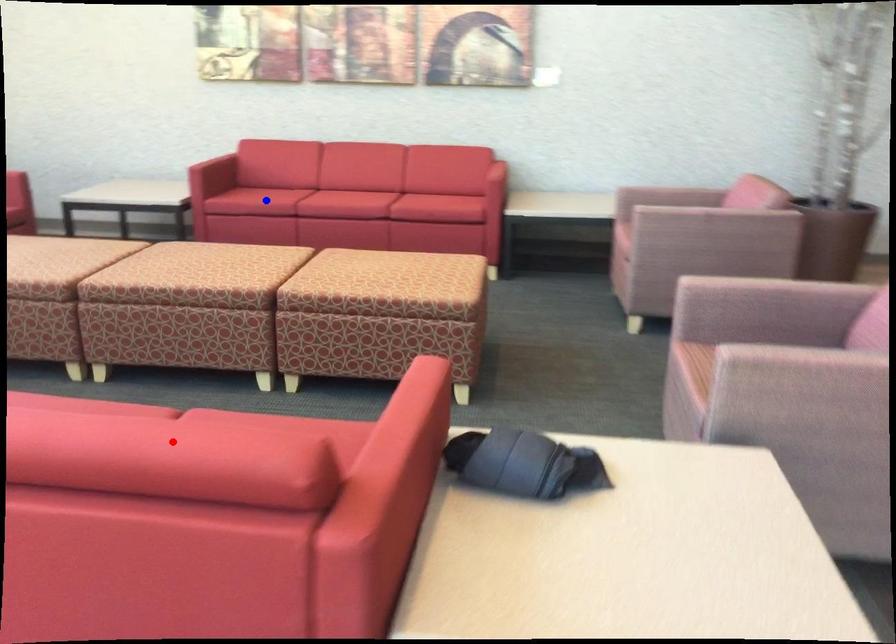
Question: Two points are marked on the image. Which point is closer to the camera?

Choices:
 (A) Blue point is closer.
 (B) Red point is closer.

Answer: (B)